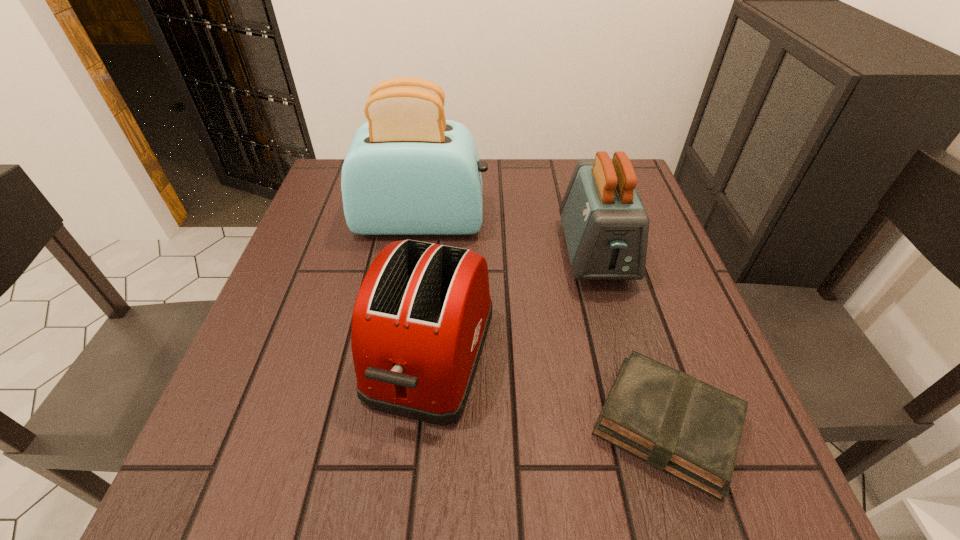
At what (x,y) coordinates should I click in order to perform the action: click on object located in the left edge section of the desktop. Please return your answer as a coordinate pair (x, y). Looking at the image, I should click on (409, 171).

Where is `toaster positioned at the right edge`? toaster positioned at the right edge is located at coordinates (606, 227).

In order to click on book that is at the right edge in this screenshot , I will do `click(674, 422)`.

Locate an element on the screen. object positioned at the far left corner is located at coordinates (409, 171).

You are a GUI agent. You are given a task and a screenshot of the screen. Output one action in this format:
    pyautogui.click(x=<x>, y=<y>)
    Task: Click on the object located in the near right corner section of the desktop
    This screenshot has height=540, width=960.
    Given the screenshot: What is the action you would take?
    pyautogui.click(x=674, y=422)

Where is `vacant space at the far edge`? Image resolution: width=960 pixels, height=540 pixels. vacant space at the far edge is located at coordinates (564, 171).

Locate an element on the screen. free space at the near edge of the desktop is located at coordinates (441, 463).

In the image, there is a desktop. Identify the location of vacant space at the left edge. (329, 281).

Locate an element on the screen. The image size is (960, 540). free region at the right edge of the desktop is located at coordinates (672, 322).

The width and height of the screenshot is (960, 540). In the image, there is a desktop. What are the coordinates of `vacant space at the far left corner` in the screenshot? It's located at (342, 170).